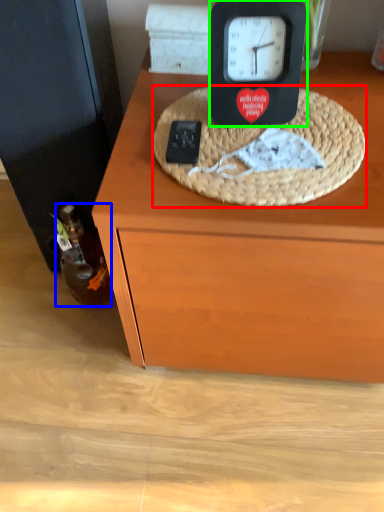
Question: Which is nearer to the basket (highlighted by a red box)? bottle (highlighted by a blue box) or clock (highlighted by a green box).

Choices:
 (A) bottle
 (B) clock

Answer: (B)